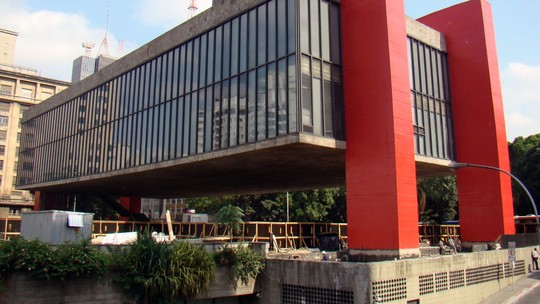
The height and width of the screenshot is (304, 540). In order to click on bottom windows between red posts in this screenshot , I will do `click(445, 131)`.